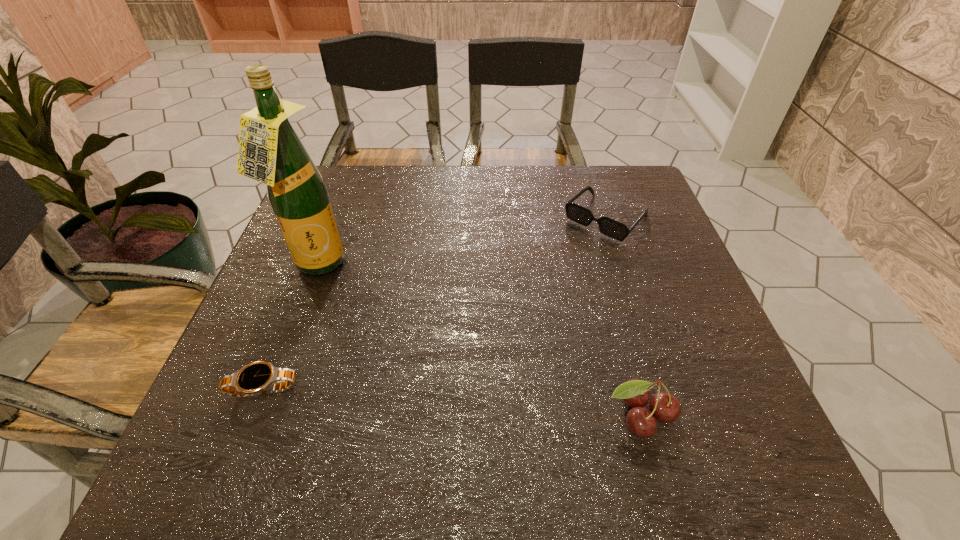
In order to click on vacant space on the desktop that is between the watch and the cherry and is positioned on the front-facing side of the liquor in this screenshot , I will do `click(448, 402)`.

Image resolution: width=960 pixels, height=540 pixels. I want to click on vacant space on the desktop that is between the watch and the third shortest object and is positioned on the front-facing side of the sunglasses, so click(x=429, y=400).